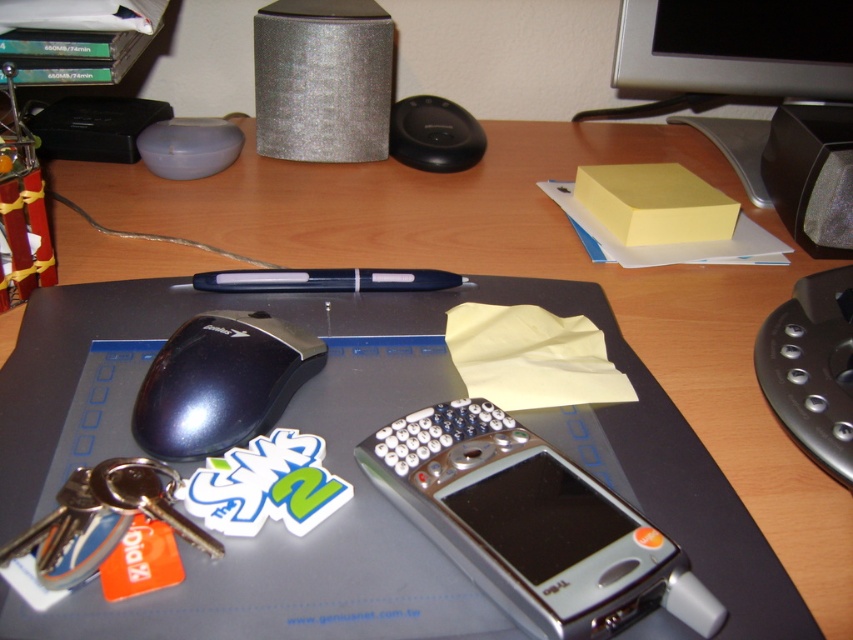
Question: Is silver metallic smartphone at center to the left of black plastic speaker at upper right from the viewer's perspective?

Choices:
 (A) yes
 (B) no

Answer: (A)

Question: Which point is closer to the camera?

Choices:
 (A) tap(315, 289)
 (B) tap(788, 32)
 (C) tap(850, 141)

Answer: (A)

Question: Which object is the closest to the silver metallic smartphone at center?

Choices:
 (A) blue plastic pen at center
 (B) silver glittery speaker at upper center
 (C) black glossy mouse at center-left
 (D) metallic keychain at lower left

Answer: (D)

Question: Is yellow matte computer monitor at upper right closer to the viewer compared to black plastic speaker at upper right?

Choices:
 (A) no
 (B) yes

Answer: (A)

Question: Which point appears closest to the camera in this image?

Choices:
 (A) (281, 371)
 (B) (457, 400)
 (C) (314, 99)
 (D) (706, 16)

Answer: (B)

Question: Is yellow matte computer monitor at upper right positioned before blue plastic pen at center?

Choices:
 (A) yes
 (B) no

Answer: (B)